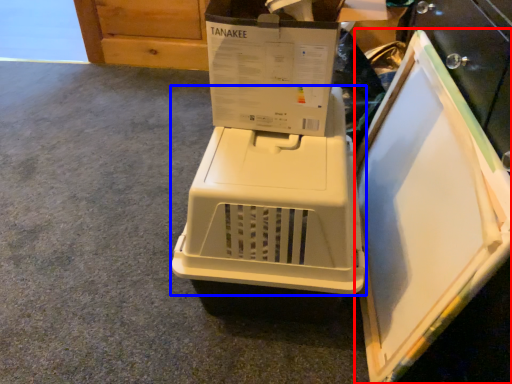
Question: Which of the following is the closest to the observer, appliance (highlighted by a red box) or home appliance (highlighted by a blue box)?

Choices:
 (A) appliance
 (B) home appliance

Answer: (A)